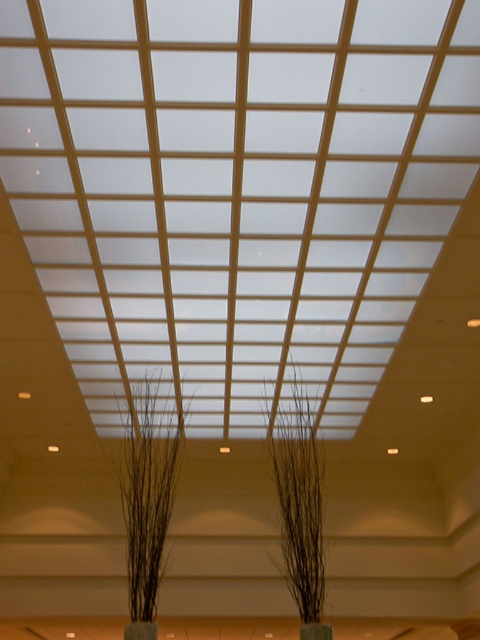
Is point (279, 490) farther from camera compared to point (124, 637)?

Yes, it is behind point (124, 637).

Does point (316, 602) come in front of point (140, 634)?

No, (316, 602) is further to viewer.

Is point (307, 460) positioned before point (156, 636)?

No, (307, 460) is further to viewer.

Locate an element on the screen. The width and height of the screenshot is (480, 640). black matte plant at center is located at coordinates (299, 499).

Is point (126, 492) positioned behind point (126, 632)?

Yes, it is behind point (126, 632).

Between brown matte plant at center and green matte vase at lower center, which one has more height?

brown matte plant at center is taller.

This screenshot has width=480, height=640. Describe the element at coordinates (147, 490) in the screenshot. I see `brown matte plant at center` at that location.

Find the location of a particular element. The image size is (480, 640). brown matte plant at center is located at coordinates (147, 490).

Does brown matte plant at center have a greater height compared to green matte vase at center?

Indeed, brown matte plant at center has a greater height compared to green matte vase at center.

Which is behind, point (122, 516) or point (304, 628)?

Point (122, 516)

The image size is (480, 640). I want to click on brown matte plant at center, so click(x=147, y=490).

This screenshot has height=640, width=480. In order to click on brown matte plant at center in this screenshot , I will do `click(147, 490)`.